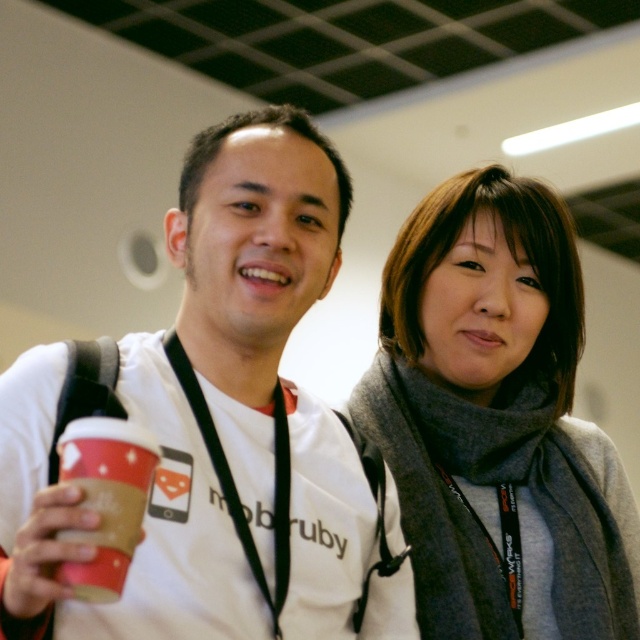
You are at a conference and need to move from your current position to the registration desk located at point (616, 538). There is an obstacle at point (330, 227). Can you safely walk around the obstacle to reach the registration desk?

Point (330, 227) is in front of point (616, 538), so the obstacle is blocking the path to the registration desk. You will need to find an alternative route around the obstacle to reach the registration desk.

You are standing in the conference room and need to locate two specific points marked in the image. Which of the two points, point (484, 602) or point (109, 593), is closer to you?

Point (484, 602) is closer to you because it is further to the viewer than point (109, 593).

You are at a conference and need to locate your colleague who is wearing a gray wool scarf at upper right. You see the brown paper cup at left in your line of sight. Which object should you look above to find your colleague?

The gray wool scarf at upper right is located above the brown paper cup at left, so you should look above the brown paper cup at left to find your colleague wearing the gray wool scarf at upper right.